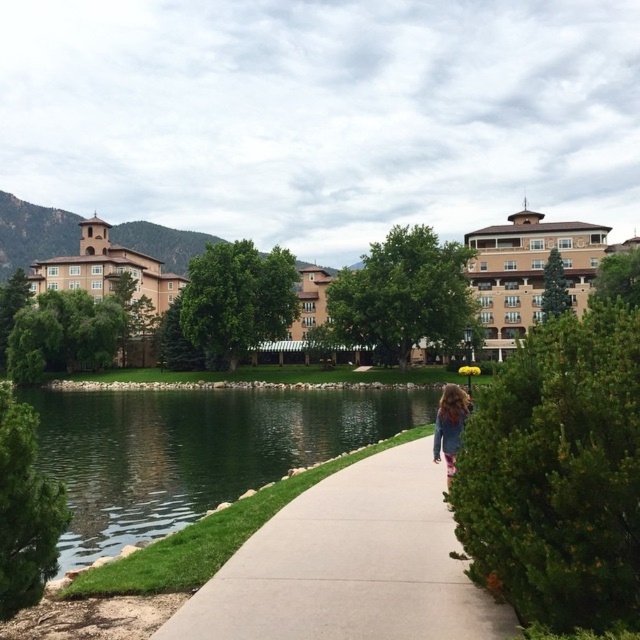
Can you confirm if smooth concrete sidewalk at center is bigger than denim jacket at center?

Incorrect, smooth concrete sidewalk at center is not larger than denim jacket at center.

Which is behind, point (403, 486) or point (445, 436)?

Positioned behind is point (445, 436).

Who is more distant from viewer, (268,577) or (440,445)?

The point (440,445) is behind.

The height and width of the screenshot is (640, 640). Find the location of `smooth concrete sidewalk at center`. smooth concrete sidewalk at center is located at coordinates (349, 564).

Is point (339, 618) positioned after point (120, 538)?

No, it is not.

Who is taller, smooth concrete sidewalk at center or green liquid water at lower left?

green liquid water at lower left is taller.

The image size is (640, 640). What do you see at coordinates (349, 564) in the screenshot? I see `smooth concrete sidewalk at center` at bounding box center [349, 564].

What are the coordinates of `smooth concrete sidewalk at center` in the screenshot? It's located at (349, 564).

Who is more distant from viewer, (225, 483) or (448, 486)?

Point (225, 483)

The height and width of the screenshot is (640, 640). What do you see at coordinates (193, 449) in the screenshot?
I see `green liquid water at lower left` at bounding box center [193, 449].

What do you see at coordinates (193, 449) in the screenshot?
I see `green liquid water at lower left` at bounding box center [193, 449].

Find the location of a particular element. The height and width of the screenshot is (640, 640). green liquid water at lower left is located at coordinates (193, 449).